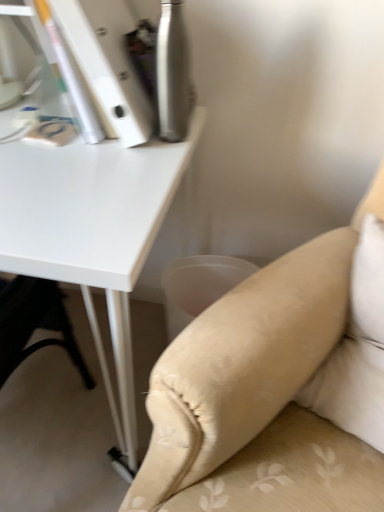
Question: Could you tell me if beige fabric couch at lower right is facing beige fabric pillow at lower right?

Choices:
 (A) no
 (B) yes

Answer: (A)

Question: Does beige fabric couch at lower right have a greater width compared to beige fabric pillow at lower right?

Choices:
 (A) yes
 (B) no

Answer: (A)

Question: From the image's perspective, is beige fabric couch at lower right over beige fabric pillow at lower right?

Choices:
 (A) no
 (B) yes

Answer: (A)

Question: Is beige fabric couch at lower right shorter than beige fabric pillow at lower right?

Choices:
 (A) yes
 (B) no

Answer: (B)

Question: Does beige fabric couch at lower right have a greater height compared to beige fabric pillow at lower right?

Choices:
 (A) no
 (B) yes

Answer: (B)

Question: Is beige fabric couch at lower right located outside beige fabric pillow at lower right?

Choices:
 (A) no
 (B) yes

Answer: (B)

Question: From a real-world perspective, is beige fabric pillow at lower right on white matte table at upper left?

Choices:
 (A) yes
 (B) no

Answer: (A)

Question: Is beige fabric pillow at lower right aimed at white matte table at upper left?

Choices:
 (A) yes
 (B) no

Answer: (B)

Question: Can you confirm if beige fabric pillow at lower right is smaller than white matte table at upper left?

Choices:
 (A) yes
 (B) no

Answer: (A)

Question: Is the depth of beige fabric pillow at lower right less than that of white matte table at upper left?

Choices:
 (A) no
 (B) yes

Answer: (B)

Question: Is beige fabric pillow at lower right located outside white matte table at upper left?

Choices:
 (A) yes
 (B) no

Answer: (A)

Question: Does beige fabric pillow at lower right appear on the left side of white matte table at upper left?

Choices:
 (A) yes
 (B) no

Answer: (B)

Question: Could beige fabric pillow at lower right be considered to be inside white matte table at upper left?

Choices:
 (A) yes
 (B) no

Answer: (B)